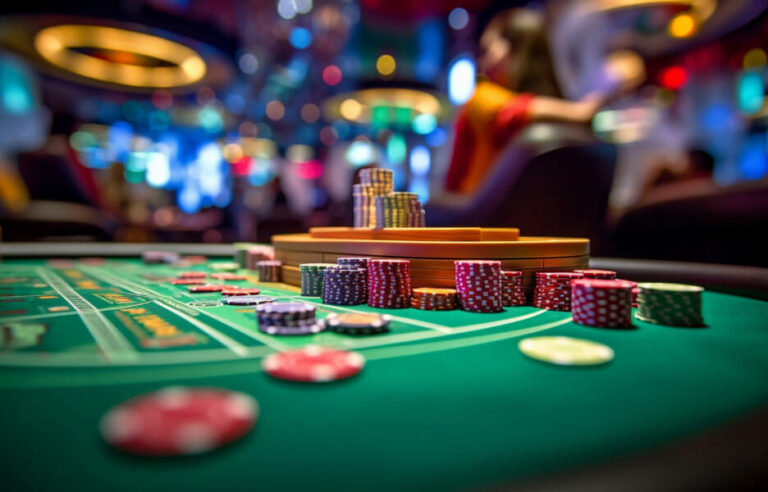
Locate an element on the screen. The image size is (768, 492). labeled section on poker table is located at coordinates (34, 287), (107, 274), (137, 331), (51, 341).